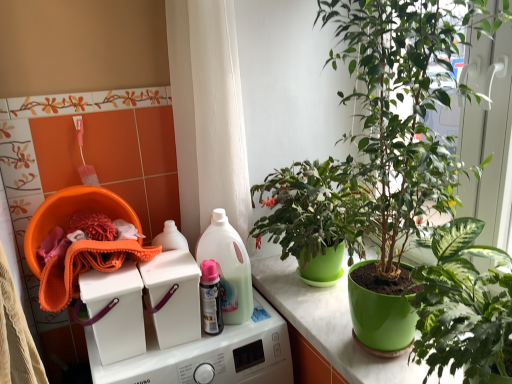
Question: From the image's perspective, does orange microfiber cloth at left appear higher than green glossy pot at center, which ranks as the first houseplant in top-to-bottom order?

Choices:
 (A) yes
 (B) no

Answer: (B)

Question: Is orange microfiber cloth at left shorter than green glossy pot at center, which ranks as the first houseplant in top-to-bottom order?

Choices:
 (A) no
 (B) yes

Answer: (B)

Question: Considering the relative positions of orange microfiber cloth at left and green glossy pot at center, which ranks as the first houseplant in top-to-bottom order, in the image provided, is orange microfiber cloth at left to the left of green glossy pot at center, which ranks as the first houseplant in top-to-bottom order, from the viewer's perspective?

Choices:
 (A) yes
 (B) no

Answer: (A)

Question: Does orange microfiber cloth at left have a smaller size compared to green glossy pot at center, which ranks as the first houseplant in top-to-bottom order?

Choices:
 (A) yes
 (B) no

Answer: (A)

Question: Is green glossy pot at center, the second houseplant ordered from the bottom, completely or partially inside orange microfiber cloth at left?

Choices:
 (A) no
 (B) yes

Answer: (A)

Question: Can you confirm if orange microfiber cloth at left is positioned to the right of green glossy pot at center, the second houseplant ordered from the bottom?

Choices:
 (A) no
 (B) yes

Answer: (A)

Question: Does white plastic washing machine at upper center, acting as the 2th washing machine starting from the bottom, contain green glossy pot at right, positioned as the first houseplant in bottom-to-top order?

Choices:
 (A) no
 (B) yes

Answer: (A)

Question: Can you confirm if white plastic washing machine at upper center, acting as the 2th washing machine starting from the bottom, is smaller than green glossy pot at right, positioned as the first houseplant in bottom-to-top order?

Choices:
 (A) no
 (B) yes

Answer: (B)

Question: From the image's perspective, would you say white plastic washing machine at upper center, acting as the 2th washing machine starting from the bottom, is shown under green glossy pot at right, the second houseplant positioned from the top?

Choices:
 (A) yes
 (B) no

Answer: (A)

Question: From the image's perspective, does white plastic washing machine at upper center, acting as the 2th washing machine starting from the bottom, appear higher than green glossy pot at right, the second houseplant positioned from the top?

Choices:
 (A) yes
 (B) no

Answer: (B)

Question: Considering the relative positions of white plastic washing machine at upper center, which is the 2th washing machine from top to bottom, and green glossy pot at right, positioned as the first houseplant in bottom-to-top order, in the image provided, is white plastic washing machine at upper center, which is the 2th washing machine from top to bottom, in front of green glossy pot at right, positioned as the first houseplant in bottom-to-top order,?

Choices:
 (A) yes
 (B) no

Answer: (B)

Question: Is green glossy pot at right, the second houseplant positioned from the top, at the back of white plastic washing machine at upper center, which is the 2th washing machine from top to bottom?

Choices:
 (A) no
 (B) yes

Answer: (A)

Question: From the image's perspective, would you say green glossy pot at center, the second houseplant ordered from the bottom, is positioned over white plastic washing machine at center, marked as the 1th washing machine in a top-to-bottom arrangement?

Choices:
 (A) yes
 (B) no

Answer: (A)